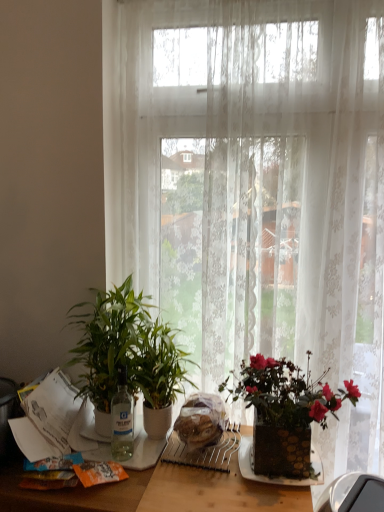
Question: Is point (130, 364) closer or farther from the camera than point (152, 256)?

Choices:
 (A) farther
 (B) closer

Answer: (B)

Question: Considering the positions of green glossy plant at center, which is the 2th houseplant in left-to-right order, and white lace curtain at center in the image, is green glossy plant at center, which is the 2th houseplant in left-to-right order, taller or shorter than white lace curtain at center?

Choices:
 (A) tall
 (B) short

Answer: (B)

Question: Which object is the farthest from the green glossy plant at center, which is the 2th houseplant in left-to-right order?

Choices:
 (A) white lace curtain at center
 (B) translucent plastic bread at center
 (C) green glossy plant at left, the second houseplant positioned from the right
 (D) matte brown plate at center
 (E) transparent glass bottle at center

Answer: (A)

Question: Estimate the real-world distances between objects in this image. Which object is farther from the transparent glass bottle at center?

Choices:
 (A) white lace curtain at center
 (B) translucent plastic bread at center
 (C) green glossy plant at left, marked as the 1th houseplant in a left-to-right arrangement
 (D) green glossy plant at center, acting as the 1th houseplant starting from the right
 (E) wooden table at center

Answer: (A)